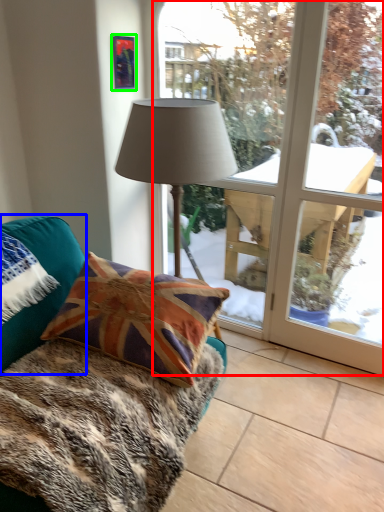
Question: Which object is positioned farthest from bay window (highlighted by a red box)? Select from pillow (highlighted by a blue box) and picture frame (highlighted by a green box).

Choices:
 (A) pillow
 (B) picture frame

Answer: (B)